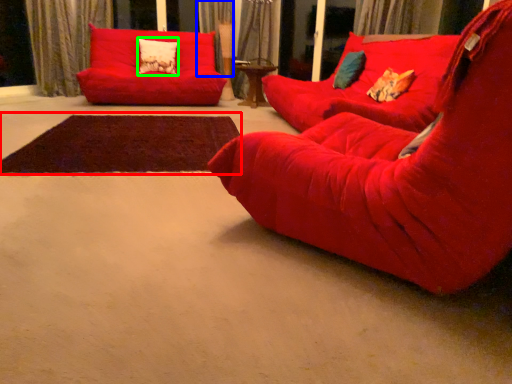
Question: Based on their relative distances, which object is nearer to mat (highlighted by a red box)? Choose from curtain (highlighted by a blue box) and pillow (highlighted by a green box).

Choices:
 (A) curtain
 (B) pillow

Answer: (B)